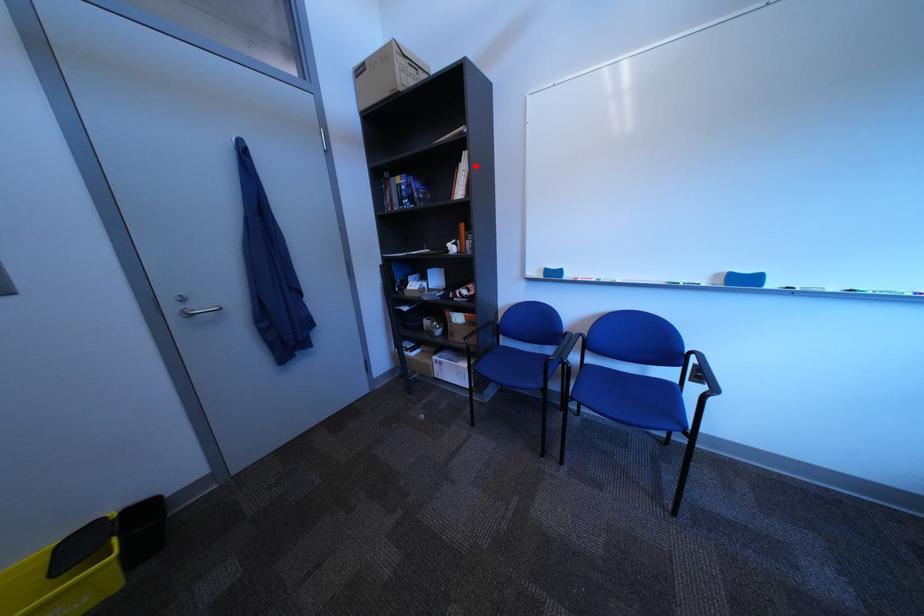
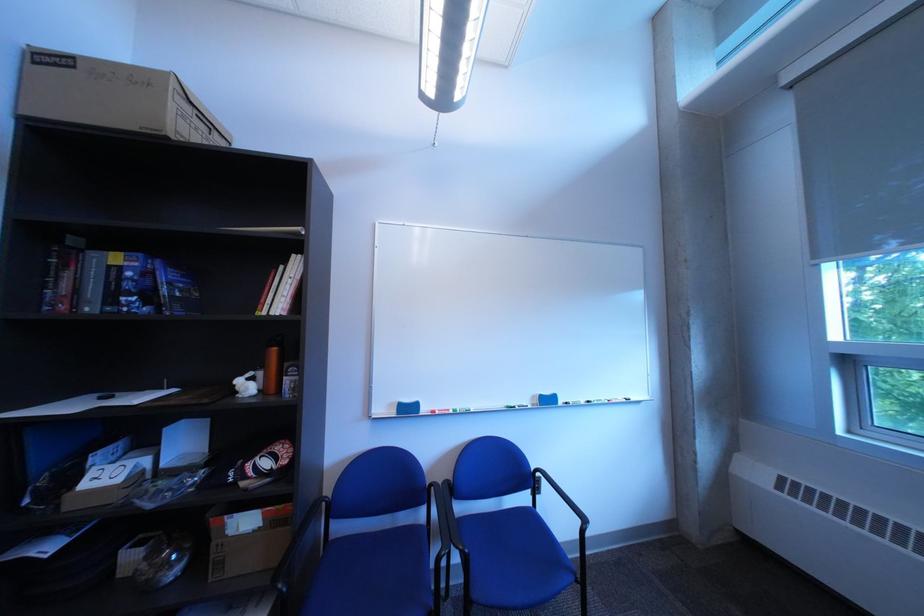
Question: I am providing you with two images of the same scene from different viewpoints. Given a red point in image1, look at the same physical point in image2. Is it:

Choices:
 (A) Closer to the viewpoint
 (B) Farther from the viewpoint

Answer: (B)